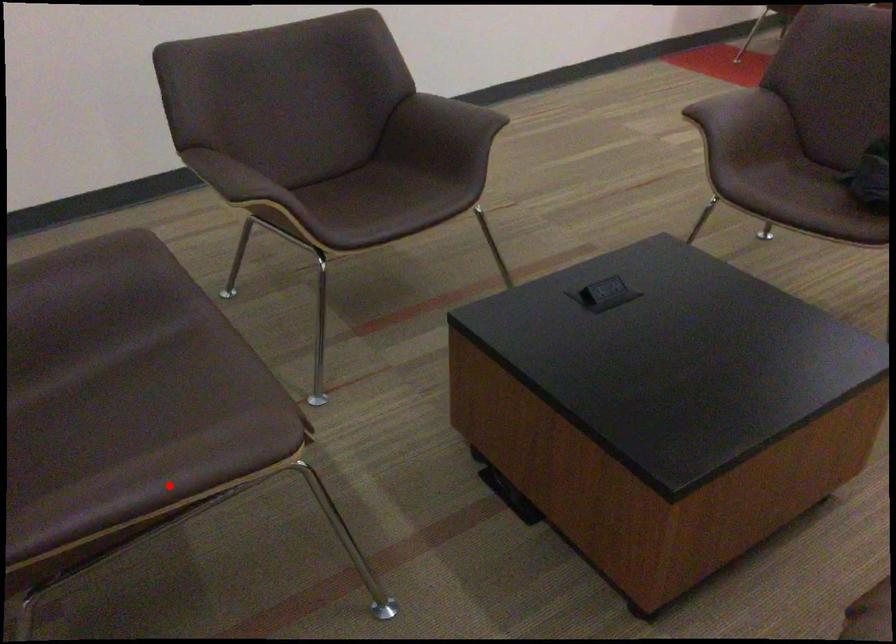
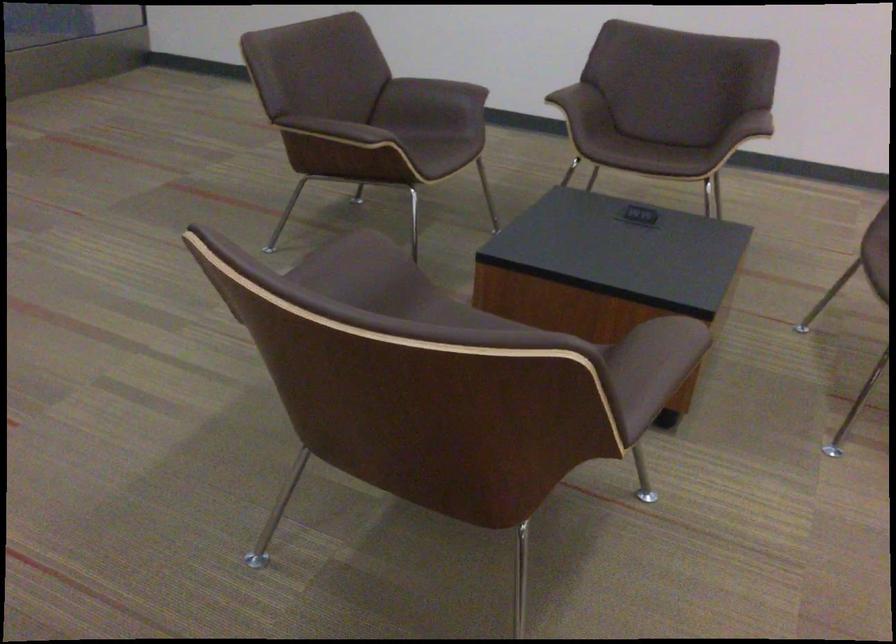
Question: I am providing you with two images of the same scene from different viewpoints. Given a red point in image1, look at the same physical point in image2. Is it:

Choices:
 (A) Closer to the viewpoint
 (B) Farther from the viewpoint

Answer: (B)